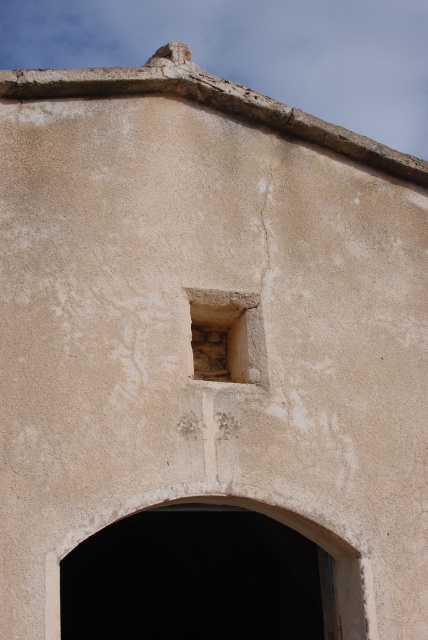
Based on the photo, you are an architect examining the building exterior. You notice the transparent glass window at upper center and the rough stone window at upper center. Which one is positioned in front of the other?

The transparent glass window at upper center is positioned in front of the rough stone window at upper center since it is closer to the viewer.

You are an architect examining the building exterior. You notice both the transparent glass window at upper center and the rough stone window at upper center. Which of these two windows is taller?

The transparent glass window at upper center is taller than the rough stone window at upper center according to the description.